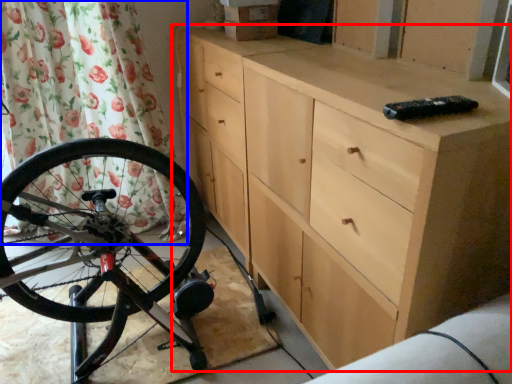
Question: Among these objects, which one is nearest to the camera, chest of drawers (highlighted by a red box) or shower curtain (highlighted by a blue box)?

Choices:
 (A) chest of drawers
 (B) shower curtain

Answer: (A)